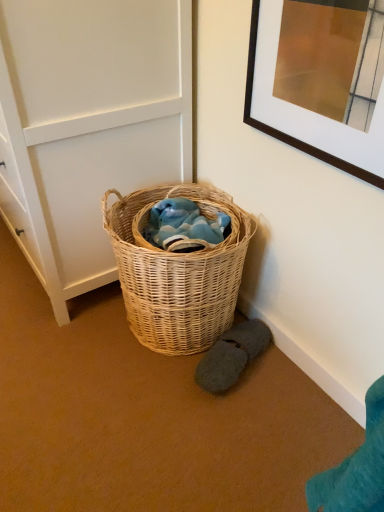
Question: Can we say dark gray fuzzy slippers at lower right lies outside woven natural basket at center?

Choices:
 (A) yes
 (B) no

Answer: (A)

Question: Is dark gray fuzzy slippers at lower right thinner than woven natural basket at center?

Choices:
 (A) no
 (B) yes

Answer: (B)

Question: Considering the relative positions of dark gray fuzzy slippers at lower right and woven natural basket at center in the image provided, is dark gray fuzzy slippers at lower right to the right of woven natural basket at center from the viewer's perspective?

Choices:
 (A) yes
 (B) no

Answer: (A)

Question: From the image's perspective, would you say dark gray fuzzy slippers at lower right is shown under woven natural basket at center?

Choices:
 (A) yes
 (B) no

Answer: (A)

Question: Is the position of dark gray fuzzy slippers at lower right more distant than that of woven natural basket at center?

Choices:
 (A) no
 (B) yes

Answer: (B)

Question: From a real-world perspective, is dark gray fuzzy slippers at lower right positioned over woven natural basket at center based on gravity?

Choices:
 (A) no
 (B) yes

Answer: (A)

Question: Is dark gray fuzzy slippers at lower right shorter than white paneling at center?

Choices:
 (A) yes
 (B) no

Answer: (A)

Question: Is the position of dark gray fuzzy slippers at lower right less distant than that of white paneling at center?

Choices:
 (A) no
 (B) yes

Answer: (A)

Question: Can you confirm if dark gray fuzzy slippers at lower right is positioned to the right of white paneling at center?

Choices:
 (A) yes
 (B) no

Answer: (A)

Question: Can you confirm if dark gray fuzzy slippers at lower right is thinner than white paneling at center?

Choices:
 (A) yes
 (B) no

Answer: (A)

Question: Is dark gray fuzzy slippers at lower right next to white paneling at center and touching it?

Choices:
 (A) no
 (B) yes

Answer: (A)

Question: Does dark gray fuzzy slippers at lower right appear on the left side of white paneling at center?

Choices:
 (A) no
 (B) yes

Answer: (A)

Question: Is white paneling at center positioned far away from woven natural basket at center?

Choices:
 (A) yes
 (B) no

Answer: (B)